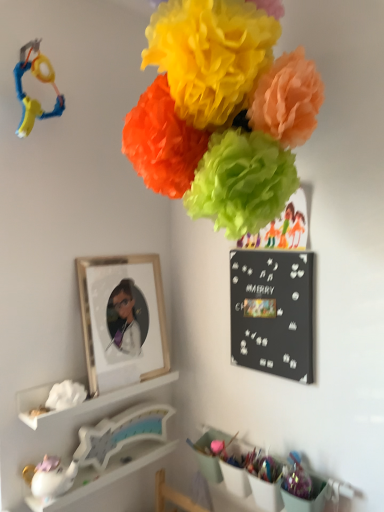
What are the coordinates of `matte plastic bags at lower center, which is the 2th shelf in top-to-bottom order` in the screenshot? It's located at (219, 469).

Image resolution: width=384 pixels, height=512 pixels. What do you see at coordinates (272, 312) in the screenshot? I see `black matte bulletin board at upper right` at bounding box center [272, 312].

I want to click on blue plastic toy at upper left, which ranks as the 2th toy in bottom-to-top order, so click(x=38, y=79).

Measure the distance between white glossy unicorn at lower left, which is the first toy in bottom-to-top order, and camera.

white glossy unicorn at lower left, which is the first toy in bottom-to-top order, is 4.05 feet away from camera.

Locate an element on the screen. white fluffy tissue at lower left, marked as the 2th flower in a top-to-bottom arrangement is located at coordinates (65, 395).

Is matte tissue paper flowers at upper center, the 1th flower from the right, turned away from matte plastic bags at lower center, the second shelf in the bottom-to-top sequence?

No, matte tissue paper flowers at upper center, the 1th flower from the right, is not facing away from matte plastic bags at lower center, the second shelf in the bottom-to-top sequence.

How different are the orientations of matte tissue paper flowers at upper center, which is the second flower from bottom to top, and matte plastic bags at lower center, which is the 2th shelf in top-to-bottom order, in degrees?

They differ by 5.31 degrees in their facing directions.

Considering the relative sizes of matte tissue paper flowers at upper center, marked as the 2th flower in a back-to-front arrangement, and matte plastic bags at lower center, the second shelf in the bottom-to-top sequence, in the image provided, is matte tissue paper flowers at upper center, marked as the 2th flower in a back-to-front arrangement, shorter than matte plastic bags at lower center, the second shelf in the bottom-to-top sequence,?

No, matte tissue paper flowers at upper center, marked as the 2th flower in a back-to-front arrangement, is not shorter than matte plastic bags at lower center, the second shelf in the bottom-to-top sequence.

Can matte plastic bags at lower center, the second shelf in the bottom-to-top sequence, be found inside matte tissue paper flowers at upper center, which is the 1th flower from front to back?

No, matte plastic bags at lower center, the second shelf in the bottom-to-top sequence, is located outside of matte tissue paper flowers at upper center, which is the 1th flower from front to back.

The height and width of the screenshot is (512, 384). Identify the location of the 3rd shelf counting from the right side of the white fluffy tissue at lower left, the 1th flower when ordered from left to right. (219, 469).

Which is nearer, (60, 400) or (198, 454)?

The point (60, 400) is closer.

Looking at this image, is white fluffy tissue at lower left, arranged as the first flower when viewed from the back, far from matte plastic bags at lower center, the second shelf in the bottom-to-top sequence?

No, there isn't a large distance between white fluffy tissue at lower left, arranged as the first flower when viewed from the back, and matte plastic bags at lower center, the second shelf in the bottom-to-top sequence.

Is white fluffy tissue at lower left, marked as the 2th flower in a top-to-bottom arrangement, smaller than matte plastic bags at lower center, the second shelf in the bottom-to-top sequence?

Indeed, white fluffy tissue at lower left, marked as the 2th flower in a top-to-bottom arrangement, has a smaller size compared to matte plastic bags at lower center, the second shelf in the bottom-to-top sequence.

Looking at this image, based on their sizes in the image, would you say white matte tissue box at lower left, the 3th shelf positioned from the bottom, is bigger or smaller than white glossy unicorn at lower left, which is the first toy in bottom-to-top order?

white matte tissue box at lower left, the 3th shelf positioned from the bottom, is bigger than white glossy unicorn at lower left, which is the first toy in bottom-to-top order.

Is white glossy unicorn at lower left, which is the first toy in bottom-to-top order, located within white matte tissue box at lower left, acting as the 1th shelf starting from the top?

No, white glossy unicorn at lower left, which is the first toy in bottom-to-top order, is not a part of white matte tissue box at lower left, acting as the 1th shelf starting from the top.

Does white matte tissue box at lower left, acting as the 1th shelf starting from the top, have a lesser height compared to white glossy unicorn at lower left, which is the first toy in bottom-to-top order?

Yes, white matte tissue box at lower left, acting as the 1th shelf starting from the top, is shorter than white glossy unicorn at lower left, which is the first toy in bottom-to-top order.

Would you say matte plastic bags at lower center, which is the 2th shelf in top-to-bottom order, is to the left or to the right of white glossy unicorn at lower left, the third shelf from the top, in the picture?

Clearly, matte plastic bags at lower center, which is the 2th shelf in top-to-bottom order, is on the right of white glossy unicorn at lower left, the third shelf from the top, in the image.

Are matte plastic bags at lower center, the second shelf in the bottom-to-top sequence, and white glossy unicorn at lower left, which is the 1th shelf from bottom to top, beside each other?

matte plastic bags at lower center, the second shelf in the bottom-to-top sequence, and white glossy unicorn at lower left, which is the 1th shelf from bottom to top, are clearly separated.

Considering the sizes of matte plastic bags at lower center, which is the 2th shelf in top-to-bottom order, and white glossy unicorn at lower left, the third shelf from the top, in the image, is matte plastic bags at lower center, which is the 2th shelf in top-to-bottom order, wider or thinner than white glossy unicorn at lower left, the third shelf from the top,?

Considering their sizes, matte plastic bags at lower center, which is the 2th shelf in top-to-bottom order, looks slimmer than white glossy unicorn at lower left, the third shelf from the top.

Find the location of a particular element. The width and height of the screenshot is (384, 512). the 3rd shelf in front of the wooden picture frame at lower left, counting from the anchor's position is located at coordinates (219, 469).

Which object is closer to the camera, matte plastic bags at lower center, which is the 2th shelf in top-to-bottom order, or wooden picture frame at lower left?

matte plastic bags at lower center, which is the 2th shelf in top-to-bottom order, is more forward.

Would you say matte plastic bags at lower center, which is the 2th shelf in top-to-bottom order, is inside or outside wooden picture frame at lower left?

matte plastic bags at lower center, which is the 2th shelf in top-to-bottom order, is not inside wooden picture frame at lower left, it's outside.

Is matte plastic bags at lower center, which is the 2th shelf in top-to-bottom order, facing towards wooden picture frame at lower left?

No.

How far apart are white glossy unicorn at lower left, the third shelf from the top, and blue plastic toy at upper left, which ranks as the 2th toy in bottom-to-top order?

The distance of white glossy unicorn at lower left, the third shelf from the top, from blue plastic toy at upper left, which ranks as the 2th toy in bottom-to-top order, is 3.74 feet.

Does white glossy unicorn at lower left, which is the 1th shelf from bottom to top, turn towards blue plastic toy at upper left, which ranks as the 2th toy in bottom-to-top order?

No.

From a real-world perspective, is white glossy unicorn at lower left, which is the 1th shelf from bottom to top, physically located above or below blue plastic toy at upper left, which ranks as the 2th toy in bottom-to-top order?

white glossy unicorn at lower left, which is the 1th shelf from bottom to top, is below blue plastic toy at upper left, which ranks as the 2th toy in bottom-to-top order.

From the image's perspective, between white glossy unicorn at lower left, which is the 1th shelf from bottom to top, and blue plastic toy at upper left, the first toy when ordered from top to bottom, which one is located above?

From the image's view, blue plastic toy at upper left, the first toy when ordered from top to bottom, is above.

Is matte tissue paper flowers at upper center, the second flower in the left-to-right sequence, in contact with white matte tissue box at lower left, the 3th shelf positioned from the bottom?

No, matte tissue paper flowers at upper center, the second flower in the left-to-right sequence, is not in contact with white matte tissue box at lower left, the 3th shelf positioned from the bottom.

Locate an element on the screen. The height and width of the screenshot is (512, 384). flower that is on the right side of white matte tissue box at lower left, the 3th shelf positioned from the bottom is located at coordinates 221,113.

Is matte tissue paper flowers at upper center, placed as the first flower when sorted from top to bottom, wider or thinner than white matte tissue box at lower left, the 3th shelf positioned from the bottom?

Clearly, matte tissue paper flowers at upper center, placed as the first flower when sorted from top to bottom, has more width compared to white matte tissue box at lower left, the 3th shelf positioned from the bottom.

Identify the location of the 2nd shelf directly beneath the matte tissue paper flowers at upper center, which is the 1th flower from front to back (from a real-world perspective). (219, 469).

In order to click on the 1st flower above when counting from the matte plastic bags at lower center, which is the 2th shelf in top-to-bottom order (from the image's perspective) in this screenshot , I will do pos(65,395).

When comparing their distances from white fluffy tissue at lower left, placed as the 2th flower when sorted from front to back, does blue plastic toy at upper left, the first toy when ordered from top to bottom, or wooden picture frame at lower left seem further?

blue plastic toy at upper left, the first toy when ordered from top to bottom, lies further to white fluffy tissue at lower left, placed as the 2th flower when sorted from front to back, than the other object.

Estimate the real-world distances between objects in this image. Which object is further from blue plastic toy at upper left, the first toy when ordered from top to bottom, white fluffy tissue at lower left, which ranks as the second flower in right-to-left order, or wooden picture frame at lower left?

Among the two, white fluffy tissue at lower left, which ranks as the second flower in right-to-left order, is located further to blue plastic toy at upper left, the first toy when ordered from top to bottom.

Considering their positions, is white fluffy tissue at lower left, marked as the 2th flower in a top-to-bottom arrangement, positioned further to blue plastic toy at upper left, the first toy when ordered from top to bottom, than black matte bulletin board at upper right?

The object further to blue plastic toy at upper left, the first toy when ordered from top to bottom, is black matte bulletin board at upper right.

Based on their spatial positions, is white fluffy tissue at lower left, the 1th flower when ordered from left to right, or white glossy unicorn at lower left, which is the 1th shelf from bottom to top, further from white matte tissue box at lower left, acting as the 1th shelf starting from the top?

white glossy unicorn at lower left, which is the 1th shelf from bottom to top, is positioned further to the anchor white matte tissue box at lower left, acting as the 1th shelf starting from the top.

Based on their spatial positions, is white glossy unicorn at lower left, which is the first toy in bottom-to-top order, or white matte tissue box at lower left, the 3th shelf positioned from the bottom, closer to white fluffy tissue at lower left, placed as the 2th flower when sorted from front to back?

Based on the image, white matte tissue box at lower left, the 3th shelf positioned from the bottom, appears to be nearer to white fluffy tissue at lower left, placed as the 2th flower when sorted from front to back.

Which object lies nearer to the anchor point white matte tissue box at lower left, acting as the 1th shelf starting from the top, blue plastic toy at upper left, the first toy when ordered from top to bottom, or white glossy unicorn at lower left, which is the second toy in top-to-bottom order?

Among the two, white glossy unicorn at lower left, which is the second toy in top-to-bottom order, is located nearer to white matte tissue box at lower left, acting as the 1th shelf starting from the top.

When comparing their distances from white glossy unicorn at lower left, which is the second toy in top-to-bottom order, does white matte tissue box at lower left, the 3th shelf positioned from the bottom, or blue plastic toy at upper left, which ranks as the 2th toy in bottom-to-top order, seem closer?

Among the two, white matte tissue box at lower left, the 3th shelf positioned from the bottom, is located nearer to white glossy unicorn at lower left, which is the second toy in top-to-bottom order.

Considering their positions, is white matte tissue box at lower left, acting as the 1th shelf starting from the top, positioned closer to blue plastic toy at upper left, which ranks as the 2th toy in bottom-to-top order, than white fluffy tissue at lower left, the first flower from the bottom?

The object closer to blue plastic toy at upper left, which ranks as the 2th toy in bottom-to-top order, is white fluffy tissue at lower left, the first flower from the bottom.

You are a GUI agent. You are given a task and a screenshot of the screen. Output one action in this format:
    pyautogui.click(x=<x>, y=<y>)
    Task: Click on the picture frame between blue plastic toy at upper left, the first toy when ordered from top to bottom, and white fluffy tissue at lower left, marked as the 2th flower in a top-to-bottom arrangement, in the vertical direction
    
    Given the screenshot: What is the action you would take?
    pyautogui.click(x=122, y=319)

At what (x,y) coordinates should I click in order to perform the action: click on picture frame between white matte tissue box at lower left, acting as the 1th shelf starting from the top, and black matte bulletin board at upper right. Please return your answer as a coordinate pair (x, y). This screenshot has width=384, height=512. Looking at the image, I should click on (122, 319).

At what (x,y) coordinates should I click in order to perform the action: click on picture frame that lies between black matte bulletin board at upper right and white glossy unicorn at lower left, which is the 1th shelf from bottom to top, from top to bottom. Please return your answer as a coordinate pair (x, y). This screenshot has width=384, height=512. Looking at the image, I should click on (122, 319).

Find the location of `picture frame situated between white fluffy tissue at lower left, the 1th flower when ordered from left to right, and matte plastic bags at lower center, the second shelf in the bottom-to-top sequence, from left to right`. picture frame situated between white fluffy tissue at lower left, the 1th flower when ordered from left to right, and matte plastic bags at lower center, the second shelf in the bottom-to-top sequence, from left to right is located at coordinates (122, 319).